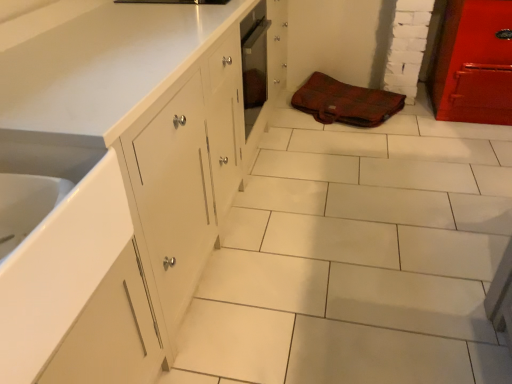
Question: Does white glossy sink at lower left have a greater height compared to brown fabric bag at center?

Choices:
 (A) yes
 (B) no

Answer: (A)

Question: From a real-world perspective, is white glossy sink at lower left below brown fabric bag at center?

Choices:
 (A) yes
 (B) no

Answer: (B)

Question: Can you confirm if white glossy sink at lower left is positioned to the left of brown fabric bag at center?

Choices:
 (A) no
 (B) yes

Answer: (B)

Question: Is white glossy sink at lower left directly adjacent to brown fabric bag at center?

Choices:
 (A) no
 (B) yes

Answer: (A)

Question: Does white glossy sink at lower left come in front of brown fabric bag at center?

Choices:
 (A) no
 (B) yes

Answer: (B)

Question: Is white glossy sink at lower left not close to brown fabric bag at center?

Choices:
 (A) no
 (B) yes

Answer: (B)

Question: Is brown fabric bag at center wider than white glossy sink at lower left?

Choices:
 (A) yes
 (B) no

Answer: (A)

Question: Is brown fabric bag at center located outside white glossy sink at lower left?

Choices:
 (A) yes
 (B) no

Answer: (A)

Question: Considering the relative sizes of brown fabric bag at center and white glossy sink at lower left in the image provided, is brown fabric bag at center thinner than white glossy sink at lower left?

Choices:
 (A) no
 (B) yes

Answer: (A)

Question: From the image's perspective, is brown fabric bag at center under white glossy sink at lower left?

Choices:
 (A) no
 (B) yes

Answer: (A)

Question: Could you tell me if brown fabric bag at center is facing white glossy sink at lower left?

Choices:
 (A) yes
 (B) no

Answer: (B)

Question: Would you say brown fabric bag at center is a long distance from white glossy sink at lower left?

Choices:
 (A) yes
 (B) no

Answer: (A)

Question: Would you say white glossy sink at lower left is to the left or to the right of brown fabric bag at center in the picture?

Choices:
 (A) left
 (B) right

Answer: (A)